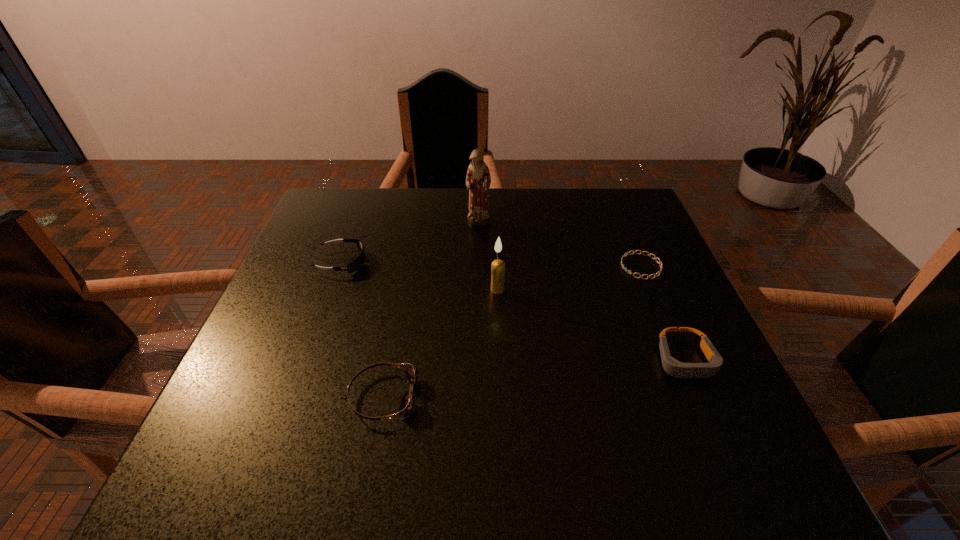
The image size is (960, 540). I want to click on vacant area located on the right of the fourth farthest object, so click(615, 289).

Identify the location of free space located 0.290m on the front and sides of the farthest goggles. The width and height of the screenshot is (960, 540). (487, 262).

The image size is (960, 540). Find the location of `vacant point located through the lenses of the second object from left to right`. vacant point located through the lenses of the second object from left to right is located at coordinates (506, 396).

This screenshot has height=540, width=960. I want to click on free point located 0.170m on the front and back of the rightmost goggles, so click(x=736, y=481).

Image resolution: width=960 pixels, height=540 pixels. In order to click on vacant space located on the surface of the bracelet showing star-shaped elements in this screenshot , I will do `click(563, 266)`.

You are a GUI agent. You are given a task and a screenshot of the screen. Output one action in this format:
    pyautogui.click(x=<x>, y=<y>)
    Task: Click on the vacant space located 0.080m on the surface of the bracelet showing star-shaped elements
    The width and height of the screenshot is (960, 540).
    Given the screenshot: What is the action you would take?
    pyautogui.click(x=588, y=266)

At what (x,y) coordinates should I click in order to perform the action: click on blank space located 0.070m on the surface of the bracelet showing star-shaped elements. Please return your answer as a coordinate pair (x, y). The height and width of the screenshot is (540, 960). Looking at the image, I should click on (591, 266).

You are a GUI agent. You are given a task and a screenshot of the screen. Output one action in this format:
    pyautogui.click(x=<x>, y=<y>)
    Task: Click on the object that is positioned at the far edge
    
    Given the screenshot: What is the action you would take?
    pyautogui.click(x=478, y=180)

The height and width of the screenshot is (540, 960). Identify the location of object at the left edge. (357, 263).

This screenshot has width=960, height=540. Find the location of `goggles located at the right edge`. goggles located at the right edge is located at coordinates (673, 367).